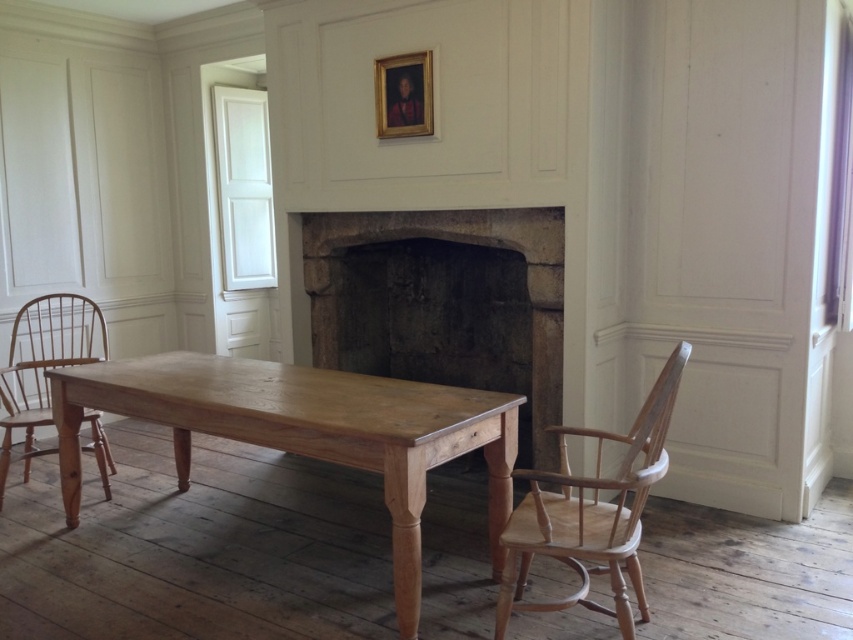
You are standing at the entrance of the room and want to move towards the natural wood chair at right. Based on its position, can you estimate how far it is from the entrance relative to the room dimensions?

The natural wood chair at right is located at point (590,513), which means it is positioned approximately 80.2 percent of the room length from the entrance and 69.4 percent from the left wall. This places it relatively close to the right side of the room and towards the back, so it should be a moderate distance from the entrance depending on the room size.